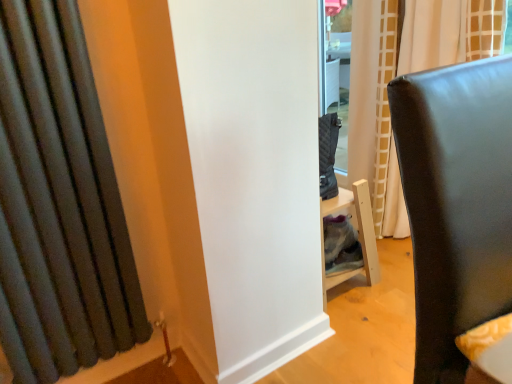
Question: Is dark gray fabric curtain at left, which is the 1th curtain from front to back, turned away from matte white curtain at center, placed as the second curtain when sorted from left to right?

Choices:
 (A) yes
 (B) no

Answer: (B)

Question: Is dark gray fabric curtain at left, acting as the 2th curtain starting from the back, not close to matte white curtain at center, which appears as the first curtain when viewed from the right?

Choices:
 (A) yes
 (B) no

Answer: (A)

Question: From the image's perspective, is dark gray fabric curtain at left, which is the 1th curtain from front to back, over matte white curtain at center, which appears as the first curtain when viewed from the right?

Choices:
 (A) no
 (B) yes

Answer: (A)

Question: Can you confirm if dark gray fabric curtain at left, marked as the 1th curtain in a left-to-right arrangement, is shorter than matte white curtain at center, which appears as the first curtain when viewed from the right?

Choices:
 (A) no
 (B) yes

Answer: (B)

Question: Does dark gray fabric curtain at left, acting as the 2th curtain starting from the back, have a larger size compared to matte white curtain at center, arranged as the first curtain when viewed from the back?

Choices:
 (A) no
 (B) yes

Answer: (A)

Question: Is dark gray fabric curtain at left, acting as the 2th curtain starting from the back, inside the boundaries of matte white curtain at center, placed as the second curtain when sorted from left to right, or outside?

Choices:
 (A) outside
 (B) inside

Answer: (A)

Question: Considering their positions, is dark gray fabric curtain at left, acting as the 2th curtain starting from the back, located in front of or behind matte white curtain at center, arranged as the first curtain when viewed from the back?

Choices:
 (A) front
 (B) behind

Answer: (A)

Question: Is dark gray fabric curtain at left, marked as the 2th curtain in a right-to-left arrangement, taller or shorter than matte white curtain at center, which appears as the first curtain when viewed from the right?

Choices:
 (A) short
 (B) tall

Answer: (A)

Question: From the image's perspective, is dark gray fabric curtain at left, marked as the 2th curtain in a right-to-left arrangement, located above or below matte white curtain at center, placed as the second curtain when sorted from left to right?

Choices:
 (A) above
 (B) below

Answer: (B)

Question: Is matte white curtain at center, placed as the second curtain when sorted from left to right, bigger or smaller than matte black chair at right?

Choices:
 (A) small
 (B) big

Answer: (B)

Question: Which is correct: matte white curtain at center, placed as the second curtain when sorted from left to right, is inside matte black chair at right, or outside of it?

Choices:
 (A) outside
 (B) inside

Answer: (A)

Question: Is point (384, 160) positioned closer to the camera than point (424, 243)?

Choices:
 (A) closer
 (B) farther

Answer: (B)

Question: In terms of height, does matte white curtain at center, arranged as the first curtain when viewed from the back, look taller or shorter compared to matte black chair at right?

Choices:
 (A) tall
 (B) short

Answer: (A)

Question: Is dark gray fabric curtain at left, marked as the 1th curtain in a left-to-right arrangement, in front of or behind matte black chair at right in the image?

Choices:
 (A) behind
 (B) front

Answer: (A)

Question: From a real-world perspective, is dark gray fabric curtain at left, marked as the 2th curtain in a right-to-left arrangement, physically located above or below matte black chair at right?

Choices:
 (A) above
 (B) below

Answer: (A)